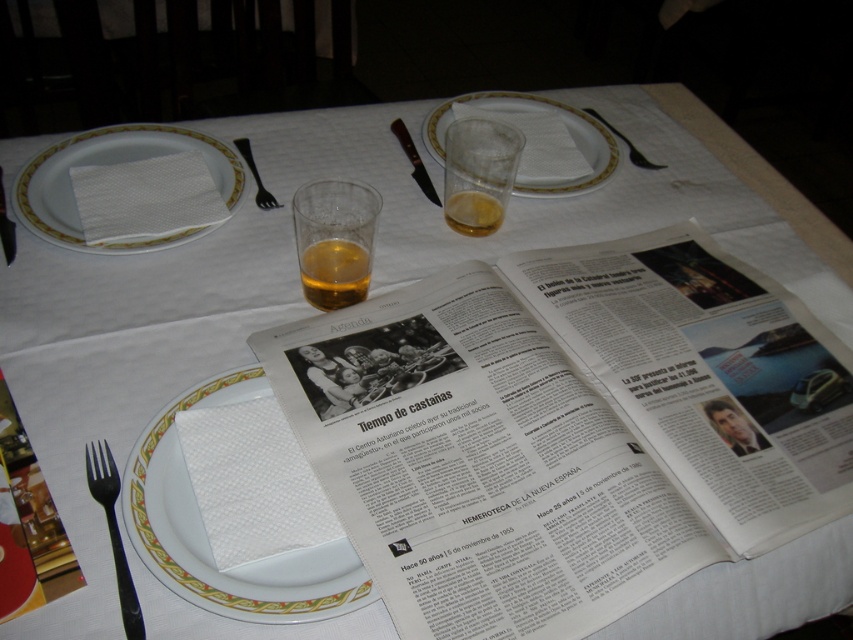
Question: Is white glossy plate at center in front of amber glass at center?

Choices:
 (A) no
 (B) yes

Answer: (B)

Question: Which point is closer to the camera?

Choices:
 (A) (453, 145)
 (B) (550, 188)
 (C) (308, 241)

Answer: (C)

Question: Can you confirm if translucent glass at center is smaller than black plastic fork at lower left?

Choices:
 (A) no
 (B) yes

Answer: (A)

Question: Among these points, which one is farthest from the camera?

Choices:
 (A) (596, 160)
 (B) (490, 131)

Answer: (A)

Question: Observing the image, what is the correct spatial positioning of translucent glass at center in reference to black plastic fork at lower left?

Choices:
 (A) below
 (B) above

Answer: (B)

Question: Which object is positioned closest to the black plastic fork at upper left?

Choices:
 (A) black plastic fork at lower left
 (B) shiny metal fork at upper right
 (C) white ceramic plate at center
 (D) translucent glass at center

Answer: (D)